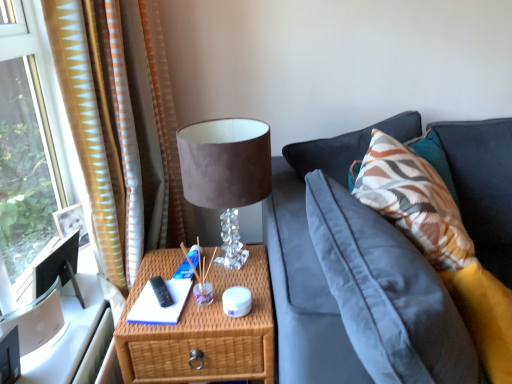
Question: Is patterned fabric pillow at right situated inside woven wood nightstand at lower center or outside?

Choices:
 (A) inside
 (B) outside

Answer: (B)

Question: From a real-world perspective, is patterned fabric pillow at right above or below woven wood nightstand at lower center?

Choices:
 (A) below
 (B) above

Answer: (B)

Question: Which is nearer to the patterned fabric pillow at right?

Choices:
 (A) gold striped curtain at left
 (B) white paper at center
 (C) suede-like brown table lamp at upper center
 (D) woven wood nightstand at lower center

Answer: (C)

Question: Which of these objects is positioned farthest from the white paper at center?

Choices:
 (A) patterned fabric pillow at right
 (B) woven wood nightstand at lower center
 (C) gold striped curtain at left
 (D) suede-like brown table lamp at upper center

Answer: (A)